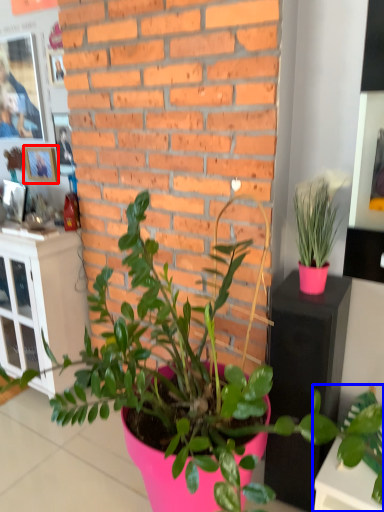
Question: Among these objects, which one is farthest to the camera, picture frame (highlighted by a red box) or houseplant (highlighted by a blue box)?

Choices:
 (A) picture frame
 (B) houseplant

Answer: (A)